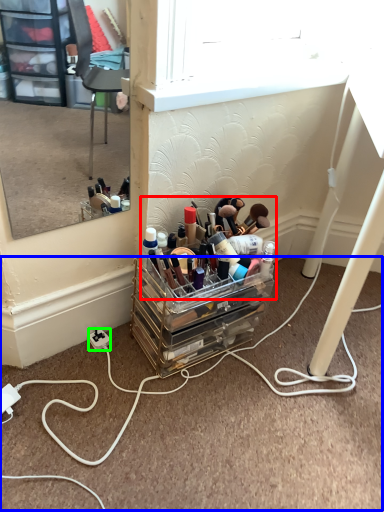
Question: Based on their relative distances, which object is farther from toiletry (highlighted by a red box)? Choose from cable (highlighted by a blue box) and power outlet (highlighted by a green box).

Choices:
 (A) cable
 (B) power outlet

Answer: (B)